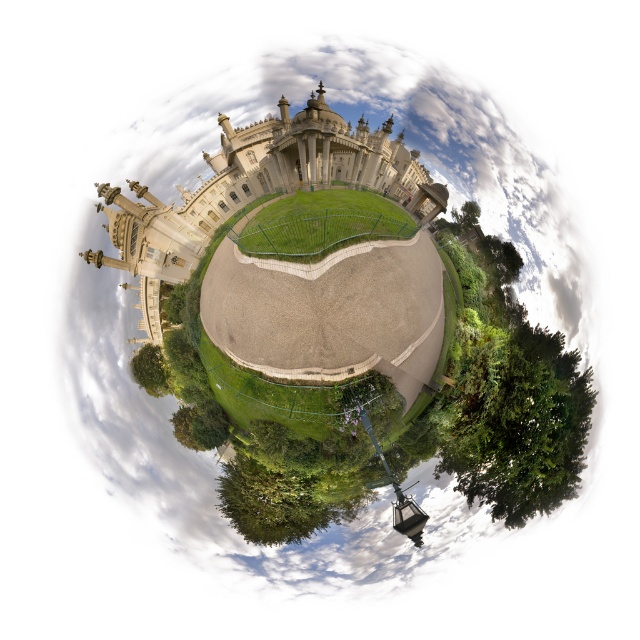
You are standing in the courtyard of the grand building and want to locate the white stone amphitheater at center. According to the coordinates provided, where exactly should you look to find it?

The white stone amphitheater at center is located at the coordinates point (250, 189), so you should look towards the lower central part of the image to find it.

You are standing in the courtyard of the grand building and want to find a spot where you can see both the green leafy tree at lower right and the green leafy tree at center without any obstruction. Considering their heights, which tree might block your view of the other?

The green leafy tree at lower right is much taller than the green leafy tree at center, so it might block the view of the shorter tree if positioned between you and it.